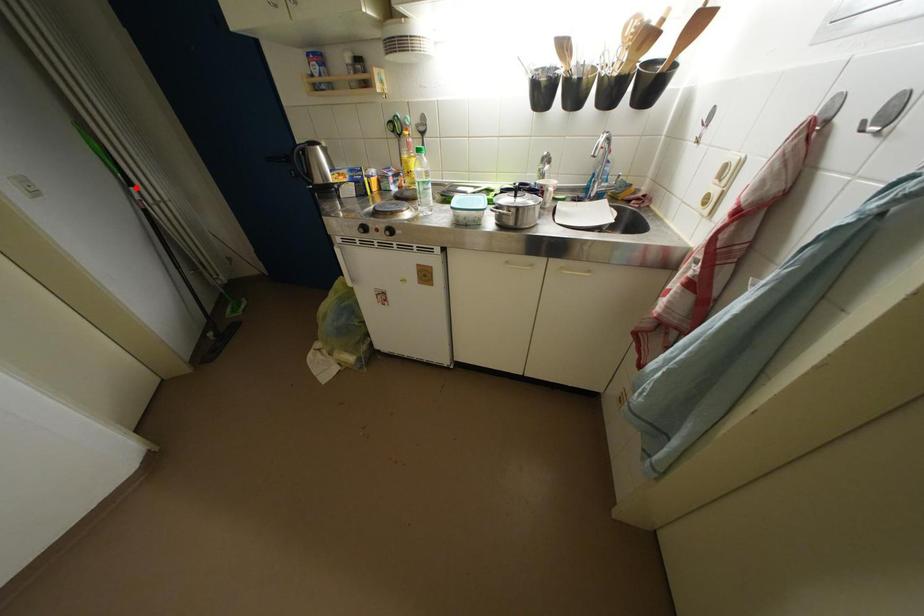
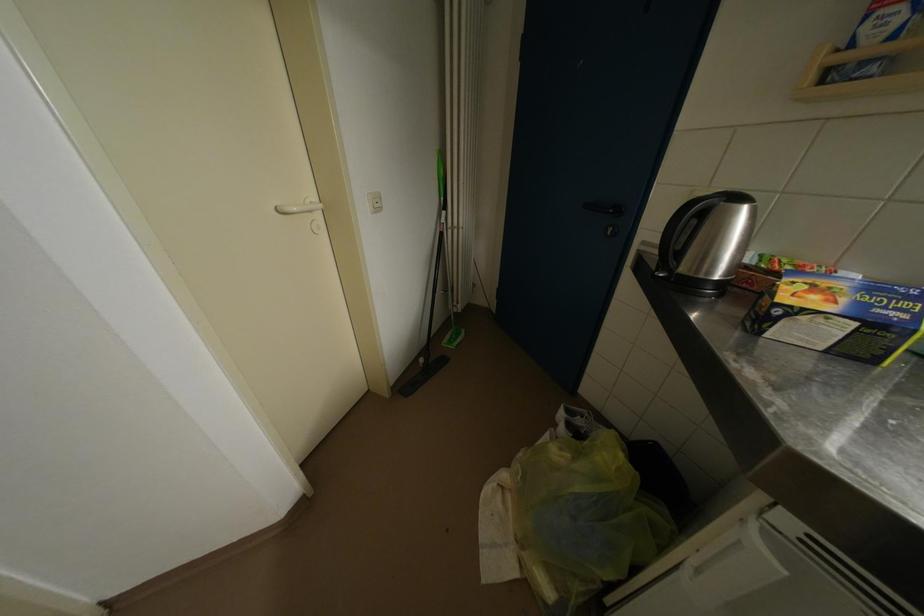
Question: A red point is marked in image1. In image2, is the corresponding 3D point closer to the camera or farther? Reply with the corresponding letter.

Choices:
 (A) The corresponding 3D point is closer.
 (B) The corresponding 3D point is farther.

Answer: (A)